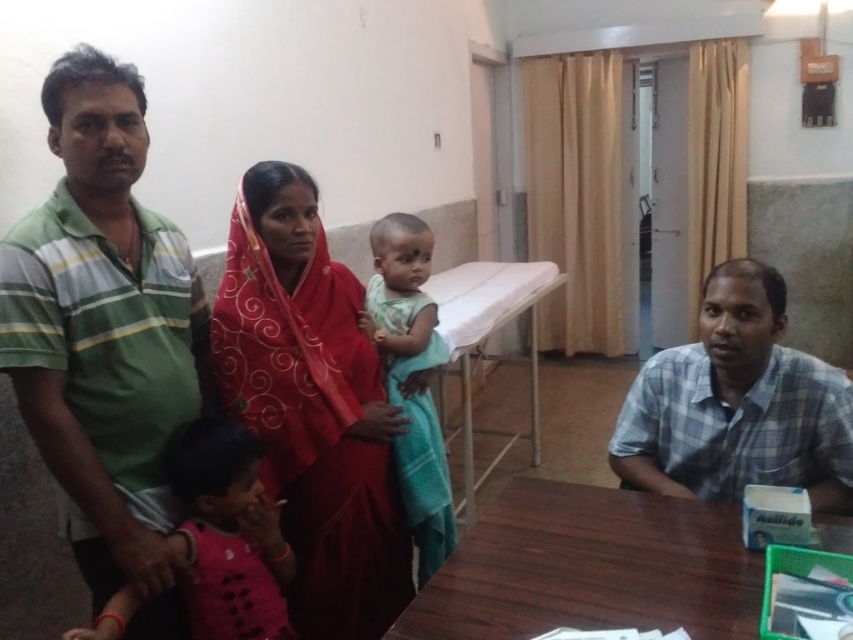
Looking at this image, you are a photographer setting up for a group photo in this room. You need to position the green striped shirt at left and the light green fabric cloth at center so that both are visible in the frame. Considering their heights, which object should be placed closer to the front of the frame?

The light green fabric cloth at center should be placed closer to the front of the frame because the green striped shirt at left is taller than it, ensuring both are visible.